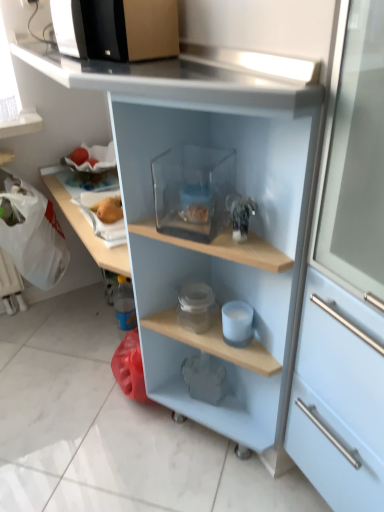
At what (x,y) coordinates should I click in order to perform the action: click on free space to the left of transparent plastic container at center. Please return your answer as a coordinate pair (x, y). This screenshot has height=512, width=384. Looking at the image, I should click on (53, 374).